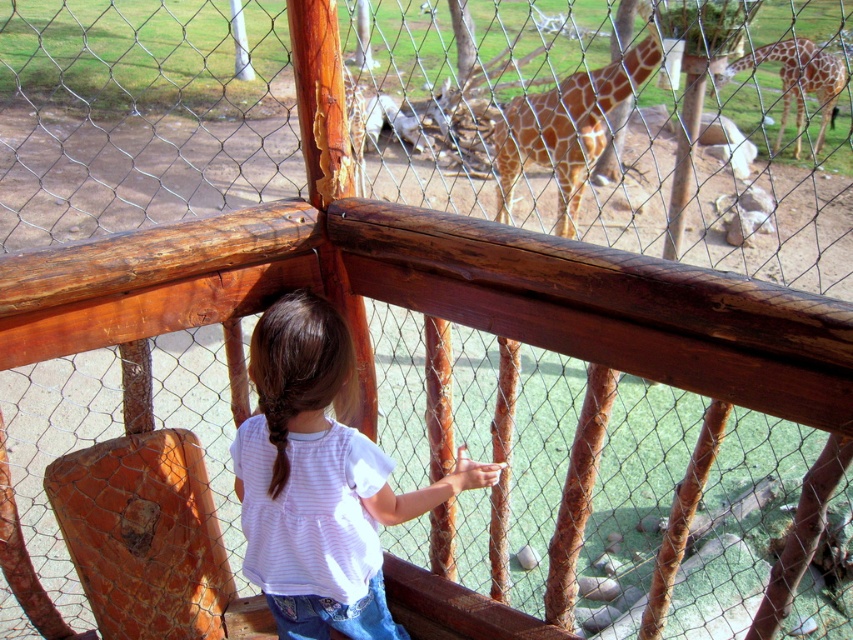
Question: Is white striped shirt at center smaller than spotted fur giraffe at upper right?

Choices:
 (A) no
 (B) yes

Answer: (B)

Question: Observing the image, what is the correct spatial positioning of white striped shirt at center in reference to spotted fur giraffe at upper right?

Choices:
 (A) above
 (B) below

Answer: (B)

Question: Among these objects, which one is farthest from the camera?

Choices:
 (A) white striped shirt at center
 (B) spotted brown giraffe at center
 (C) spotted fur giraffe at upper right

Answer: (C)

Question: Which point is farther from the camera taking this photo?

Choices:
 (A) (543, 97)
 (B) (798, 81)

Answer: (B)

Question: Does white striped shirt at center have a lesser width compared to spotted brown giraffe at center?

Choices:
 (A) no
 (B) yes

Answer: (B)

Question: Which point is closer to the camera taking this photo?

Choices:
 (A) (560, 97)
 (B) (253, 532)

Answer: (B)